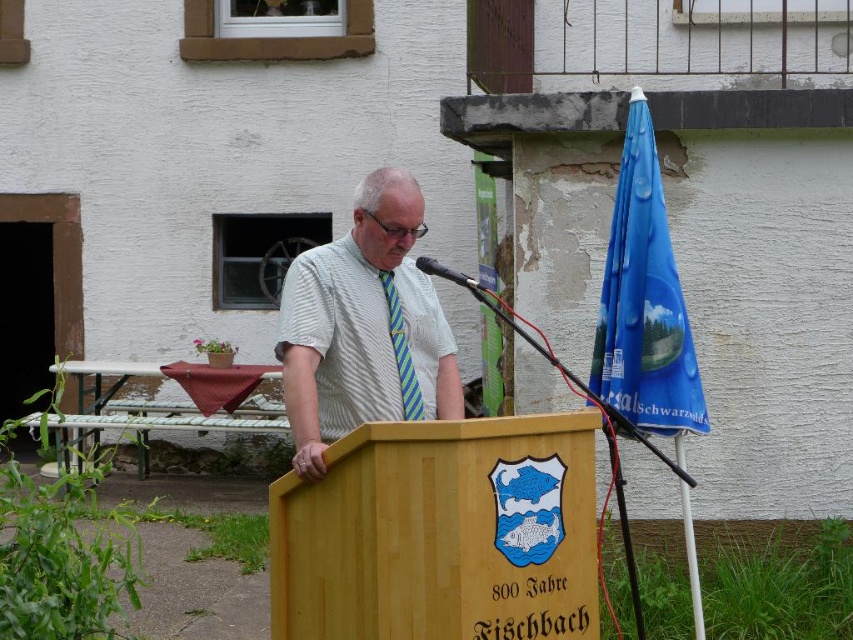
Does white striped shirt at center have a greater height compared to green striped tie at center?

Indeed, white striped shirt at center has a greater height compared to green striped tie at center.

Measure the distance between point (398,360) and camera.

Point (398,360) is 5.04 meters away from camera.

You are a GUI agent. You are given a task and a screenshot of the screen. Output one action in this format:
    pyautogui.click(x=<x>, y=<y>)
    Task: Click on the white striped shirt at center
    
    Given the screenshot: What is the action you would take?
    pyautogui.click(x=364, y=326)